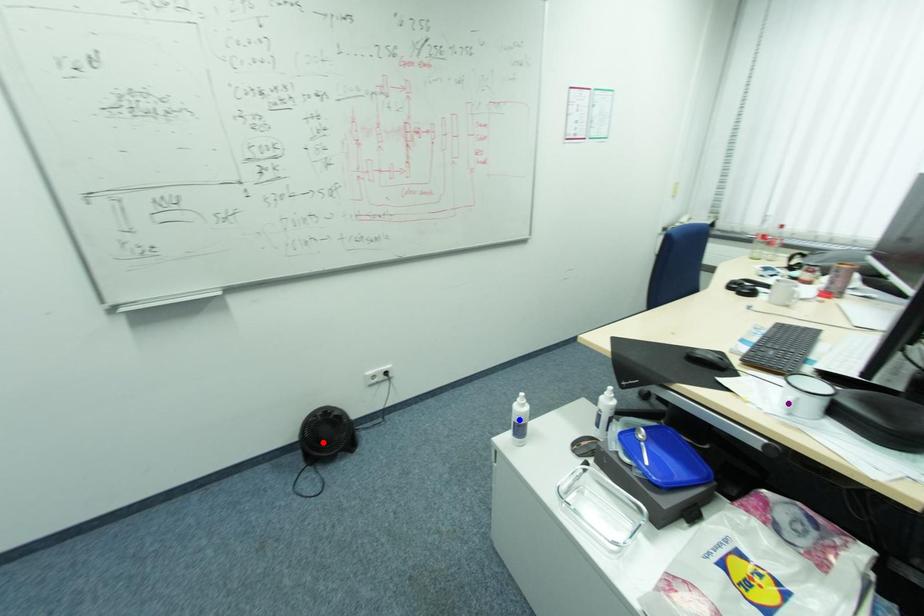
Order these from nearest to farthest:
red point
blue point
purple point

purple point
blue point
red point